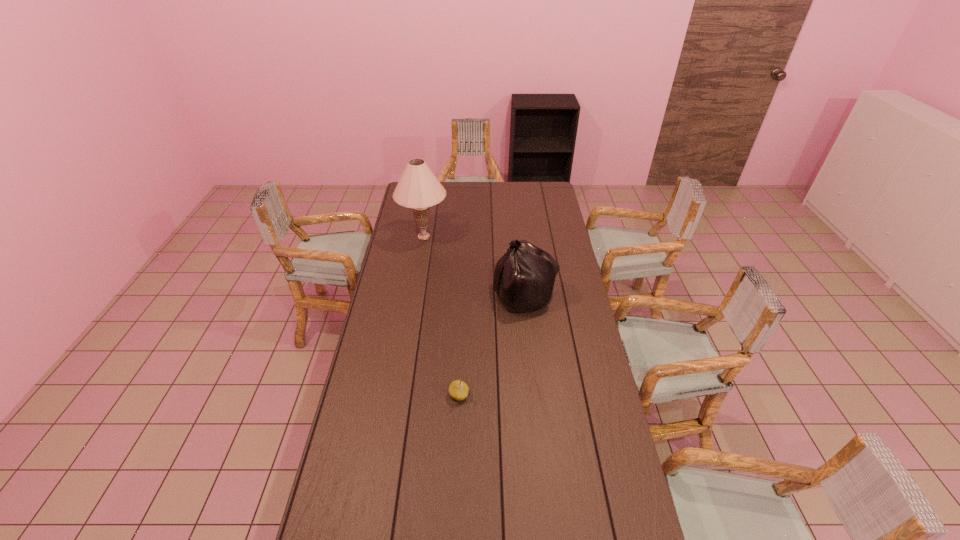
Identify the location of object at the right edge. (524, 277).

In the image, there is a desktop. Identify the location of free region at the far edge. This screenshot has width=960, height=540. pos(495,197).

You are a GUI agent. You are given a task and a screenshot of the screen. Output one action in this format:
    pyautogui.click(x=<x>, y=<y>)
    Task: Click on the vacant area at the right edge of the desktop
    The width and height of the screenshot is (960, 540).
    Given the screenshot: What is the action you would take?
    click(x=601, y=420)

This screenshot has height=540, width=960. In order to click on vacant space at the far right corner of the desktop in this screenshot , I will do `click(549, 196)`.

Where is `free area in between the leftmost object and the pear`? free area in between the leftmost object and the pear is located at coordinates (442, 315).

Locate an element on the screen. The height and width of the screenshot is (540, 960). free space between the rightmost object and the farthest object is located at coordinates (474, 266).

Find the location of a particular element. This screenshot has width=960, height=540. blank region between the nearest object and the lampshade is located at coordinates (442, 315).

Locate an element on the screen. The image size is (960, 540). empty space between the tallest object and the second tallest object is located at coordinates tap(474, 266).

You are a GUI agent. You are given a task and a screenshot of the screen. Output one action in this format:
    pyautogui.click(x=<x>, y=<y>)
    Task: Click on the unoccupied position between the nearest object and the leftmost object
    The height and width of the screenshot is (540, 960).
    Given the screenshot: What is the action you would take?
    pyautogui.click(x=442, y=315)

Select which object appears as the second closest to the second tallest object. Please provide its 2D coordinates. Your answer should be formatted as a tuple, i.e. [(x, y)], where the tuple contains the x and y coordinates of a point satisfying the conditions above.

[(458, 389)]